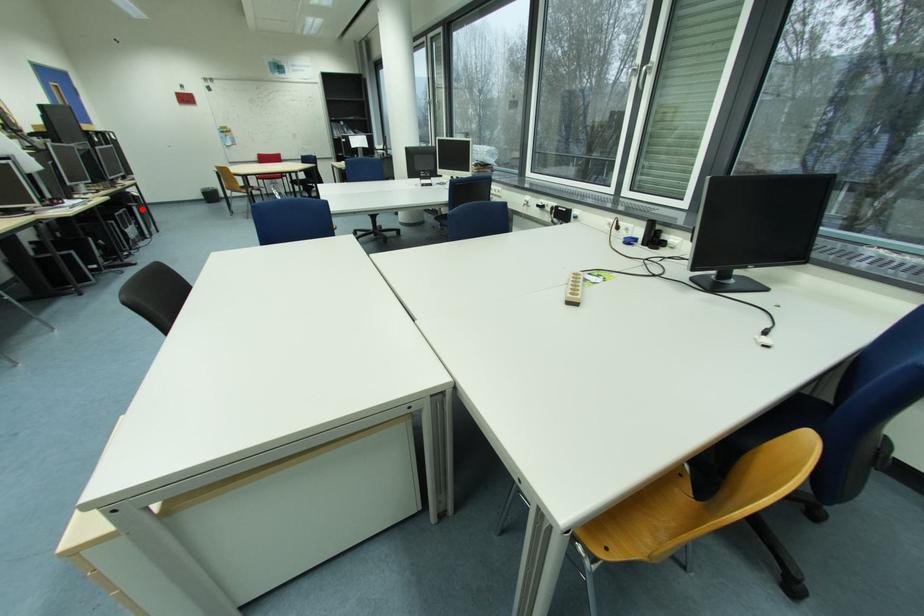
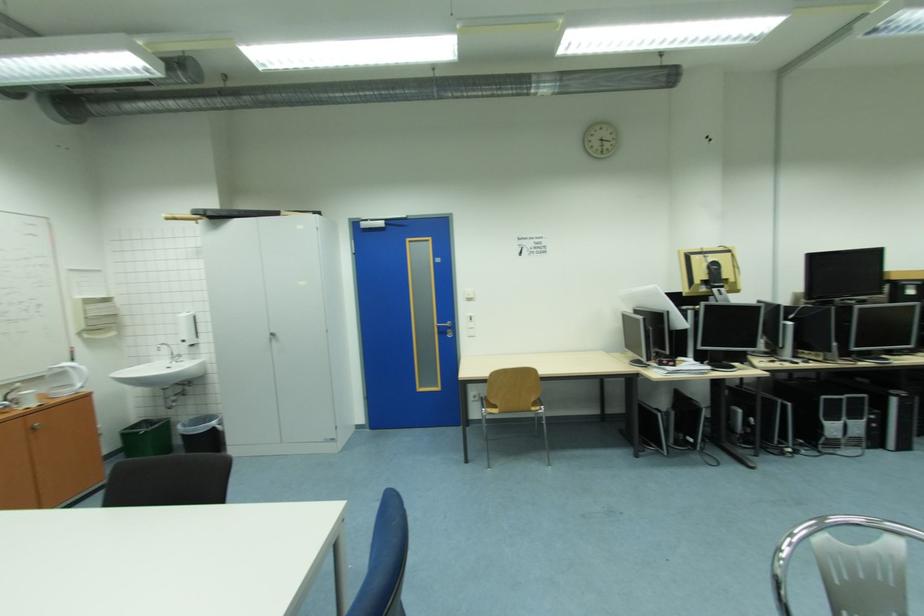
Question: A red point is marked in image1. In image2, is the corresponding 3D point closer to the camera or farther? Reply with the corresponding letter.

Choices:
 (A) The corresponding 3D point is closer.
 (B) The corresponding 3D point is farther.

Answer: (A)